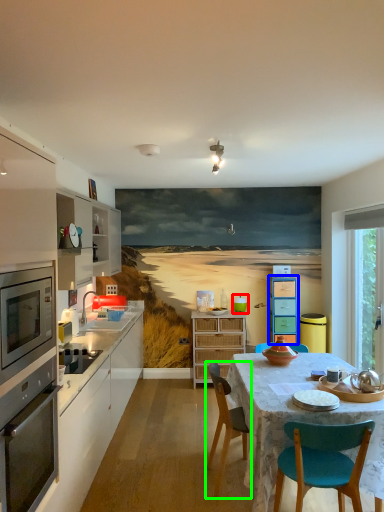
Question: Estimate the real-world distances between objects in this image. Which object is farther from teal (highlighted by a red box), cabinetry (highlighted by a blue box) or chair (highlighted by a green box)?

Choices:
 (A) cabinetry
 (B) chair

Answer: (B)